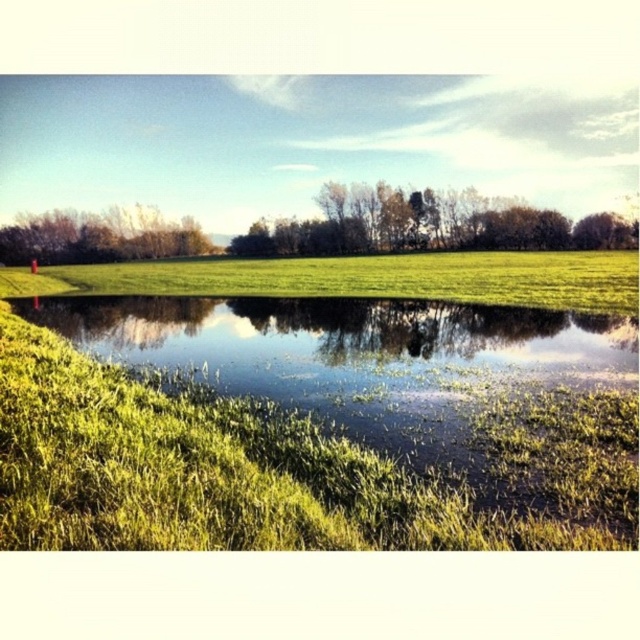
You are standing in the middle of the green leafy trees at center and want to see the brown leafy trees at upper left. Which direction should you look to see the taller trees?

The brown leafy trees at upper left are taller than the green leafy trees at center, so you should look towards the upper left direction to see the taller trees.

You are standing in the middle of the field looking at the green leafy trees at center and the brown leafy trees at upper left. Which group of trees is nearer to you?

The green leafy trees at center are closer to the viewer than the brown leafy trees at upper left.